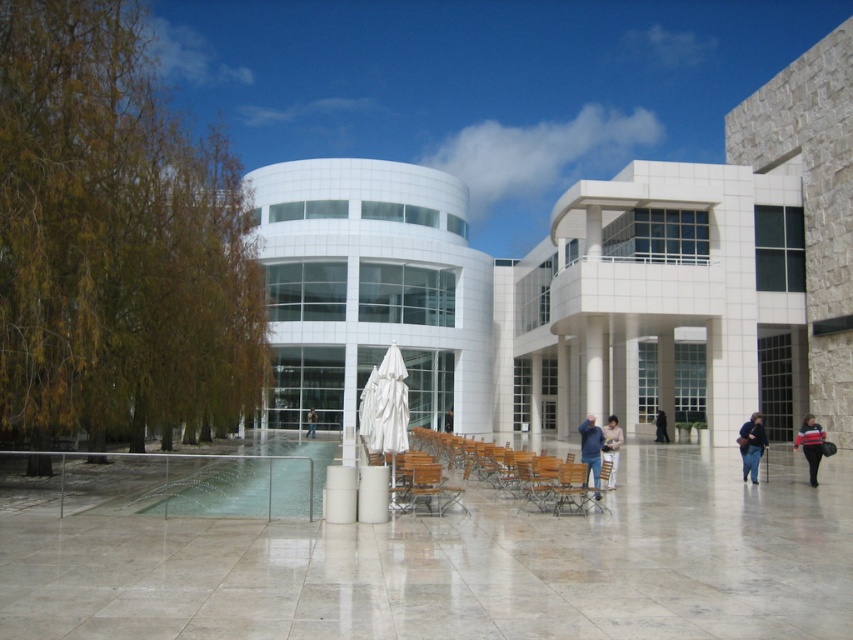
Which is below, blue denim jacket at center or black leather jacket at lower right?

black leather jacket at lower right is lower down.

Which is more to the left, blue denim jacket at center or black leather jacket at lower right?

blue denim jacket at center

Does point (593, 448) lie in front of point (662, 429)?

Yes, point (593, 448) is closer to viewer.

Where is `blue denim jacket at center`? This screenshot has width=853, height=640. blue denim jacket at center is located at coordinates (590, 451).

Between point (747, 456) and point (619, 442), which one is positioned behind?

Positioned behind is point (747, 456).

The height and width of the screenshot is (640, 853). What are the coordinates of `dark blue jeans at lower right` in the screenshot? It's located at (751, 445).

Locate an element on the screen. The image size is (853, 640). dark blue jeans at lower right is located at coordinates (751, 445).

Can you confirm if wooden chairs at center is wider than white fabric umbrella at center?

Correct, the width of wooden chairs at center exceeds that of white fabric umbrella at center.

Is wooden chairs at center above white fabric umbrella at center?

No.

Identify the location of wooden chairs at center. The height and width of the screenshot is (640, 853). (498, 468).

The height and width of the screenshot is (640, 853). What are the coordinates of `wooden chairs at center` in the screenshot? It's located at (498, 468).